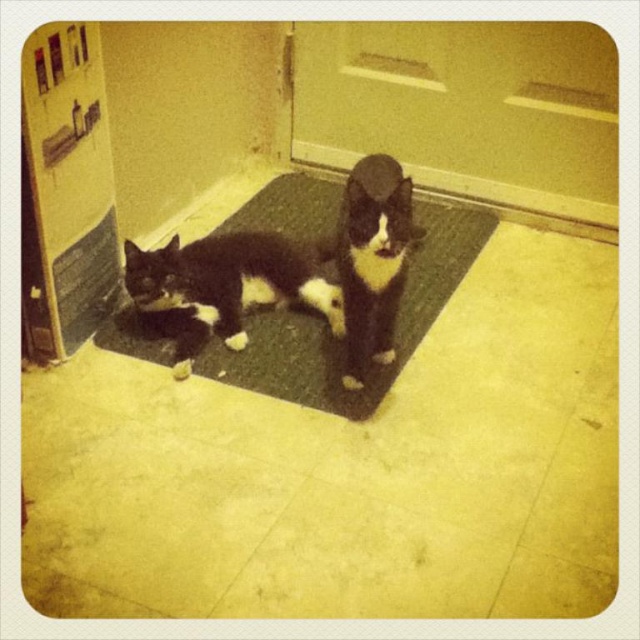
Is black rubber doormat at center positioned behind black fur cat at center?

No, black rubber doormat at center is in front of black fur cat at center.

Is point (108, 336) less distant than point (179, 349)?

No, (108, 336) is behind (179, 349).

Is point (301, 333) positioned before point (240, 339)?

No, it is not.

In order to click on black rubber doormat at center in this screenshot , I will do `click(333, 340)`.

Who is shorter, black rubber doormat at center or black and white fur cat at center?

black rubber doormat at center is shorter.

Is the position of black rubber doormat at center more distant than that of black and white fur cat at center?

Yes, it is behind black and white fur cat at center.

Who is more forward, (x=433, y=296) or (x=381, y=244)?

Point (x=381, y=244) is more forward.

Identify the location of black rubber doormat at center. (333, 340).

Which of these two, wooden door at left or black rubber doormat at center, stands shorter?

black rubber doormat at center is shorter.

Looking at this image, does wooden door at left have a larger size compared to black rubber doormat at center?

Actually, wooden door at left might be smaller than black rubber doormat at center.

Does point (112, 289) lie behind point (324, 337)?

That is True.

You are a GUI agent. You are given a task and a screenshot of the screen. Output one action in this format:
    pyautogui.click(x=<x>, y=<y>)
    Task: Click on the wooden door at left
    The image size is (640, 640).
    Given the screenshot: What is the action you would take?
    pyautogui.click(x=67, y=188)